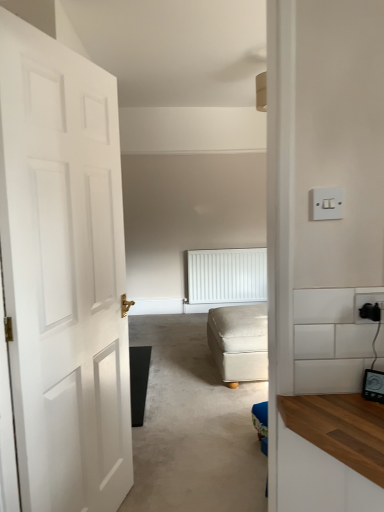
Question: Should I look upward or downward to see white matte door at left?

Choices:
 (A) up
 (B) down

Answer: (B)

Question: Is beige fabric ottoman at center in contact with white plastic light switch at upper right?

Choices:
 (A) yes
 (B) no

Answer: (B)

Question: Considering the relative sizes of beige fabric ottoman at center and white plastic light switch at upper right in the image provided, is beige fabric ottoman at center thinner than white plastic light switch at upper right?

Choices:
 (A) yes
 (B) no

Answer: (B)

Question: Does beige fabric ottoman at center lie in front of white plastic light switch at upper right?

Choices:
 (A) no
 (B) yes

Answer: (A)

Question: Would you say beige fabric ottoman at center is a long distance from white plastic light switch at upper right?

Choices:
 (A) yes
 (B) no

Answer: (A)

Question: Is beige fabric ottoman at center smaller than white plastic light switch at upper right?

Choices:
 (A) yes
 (B) no

Answer: (B)

Question: Is beige fabric ottoman at center wider than white plastic light switch at upper right?

Choices:
 (A) yes
 (B) no

Answer: (A)

Question: Does black plastic socket at right appear on the left side of white matte door at left?

Choices:
 (A) no
 (B) yes

Answer: (A)

Question: From a real-world perspective, is black plastic socket at right under white matte door at left?

Choices:
 (A) yes
 (B) no

Answer: (B)

Question: Is black plastic socket at right to the right of white matte door at left from the viewer's perspective?

Choices:
 (A) yes
 (B) no

Answer: (A)

Question: From the image's perspective, is black plastic socket at right located above white matte door at left?

Choices:
 (A) yes
 (B) no

Answer: (A)

Question: Does black plastic socket at right contain white matte door at left?

Choices:
 (A) yes
 (B) no

Answer: (B)

Question: Is black plastic socket at right with white matte door at left?

Choices:
 (A) yes
 (B) no

Answer: (B)

Question: Does white textured radiator at center have a greater width compared to black plastic socket at right?

Choices:
 (A) yes
 (B) no

Answer: (A)